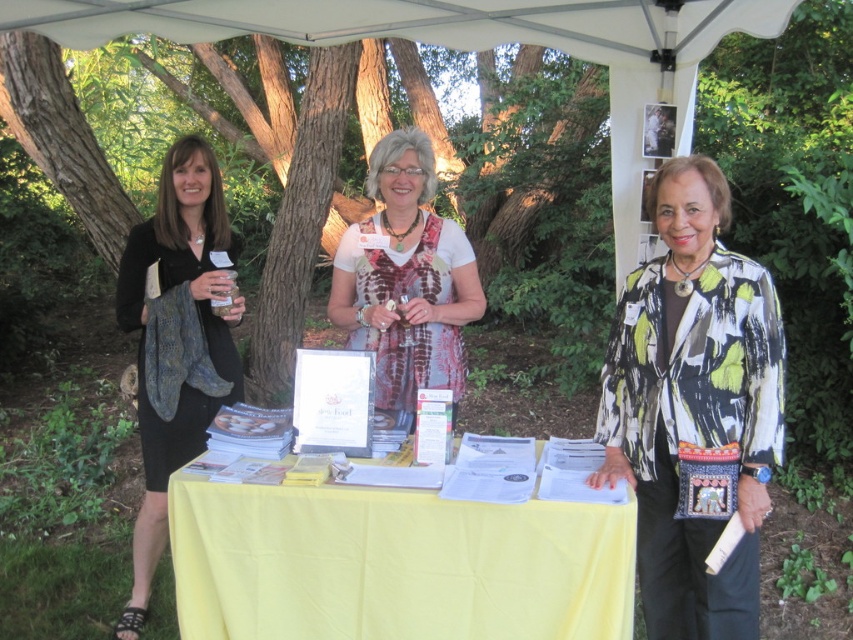
Is yellow fabric table at center above black matte scarf at left?

Actually, yellow fabric table at center is below black matte scarf at left.

Does yellow fabric table at center have a smaller size compared to black matte scarf at left?

Yes, yellow fabric table at center is smaller than black matte scarf at left.

Measure the distance between point (469, 589) and camera.

Point (469, 589) and camera are 6.40 feet apart.

Where is `yellow fabric table at center`? The image size is (853, 640). yellow fabric table at center is located at coordinates (393, 564).

The height and width of the screenshot is (640, 853). What are the coordinates of `black matte scarf at left` in the screenshot? It's located at (177, 340).

Does black matte scarf at left appear on the left side of white printed scarf at center?

Correct, you'll find black matte scarf at left to the left of white printed scarf at center.

Is point (209, 273) closer to camera compared to point (432, 365)?

Yes.

Where is `black matte scarf at left`? black matte scarf at left is located at coordinates (177, 340).

Does yellow fabric table at center have a greater width compared to printed fabric jacket at center?

Indeed, yellow fabric table at center has a greater width compared to printed fabric jacket at center.

Measure the distance between yellow fabric table at center and camera.

They are 1.84 meters apart.

The image size is (853, 640). In order to click on yellow fabric table at center in this screenshot , I will do `click(393, 564)`.